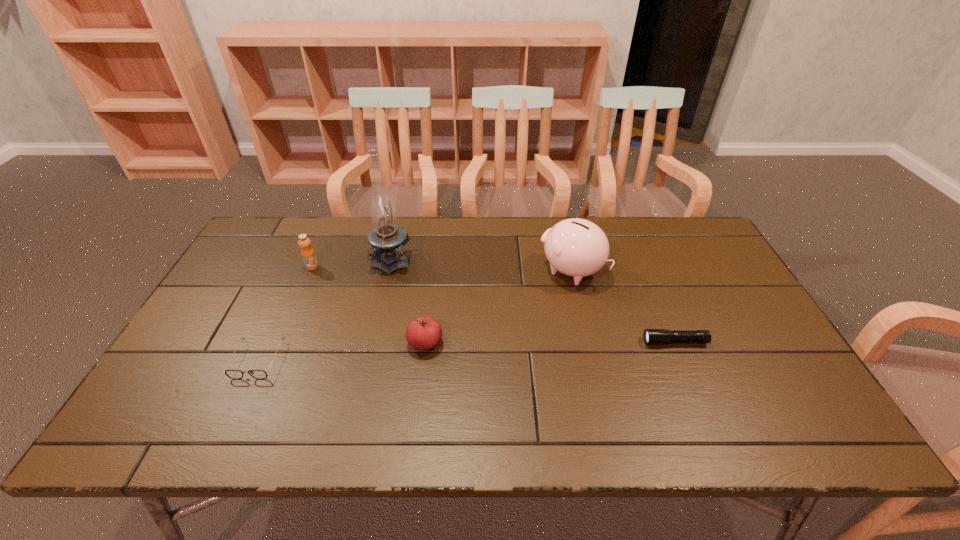
Locate an element on the screen. vacant space at the near edge is located at coordinates (222, 416).

Locate an element on the screen. vacant region at the left edge of the desktop is located at coordinates (222, 368).

Identify the location of free space at the right edge of the desktop. (766, 368).

Identify the location of free location at the far left corner. The width and height of the screenshot is (960, 540). (266, 261).

At what (x,y) coordinates should I click in order to perform the action: click on vacant area at the far right corner of the desktop. Please return your answer as a coordinate pair (x, y). The height and width of the screenshot is (540, 960). Looking at the image, I should click on (669, 251).

Image resolution: width=960 pixels, height=540 pixels. In order to click on empty space that is in between the third tallest object and the oil lamp in this screenshot , I will do `click(352, 262)`.

The width and height of the screenshot is (960, 540). Identify the location of vacant area that lies between the fourth tallest object and the second object from right to left. (498, 307).

Where is `free space between the rightmost object and the orange juice`? free space between the rightmost object and the orange juice is located at coordinates (493, 305).

Locate an element on the screen. The height and width of the screenshot is (540, 960). free area in between the third tallest object and the third object from right to left is located at coordinates (369, 305).

You are a GUI agent. You are given a task and a screenshot of the screen. Output one action in this format:
    pyautogui.click(x=<x>, y=<y>)
    Task: Click on the free point between the sunglasses and the flashlight
    Image resolution: width=960 pixels, height=540 pixels.
    Given the screenshot: What is the action you would take?
    pyautogui.click(x=467, y=351)